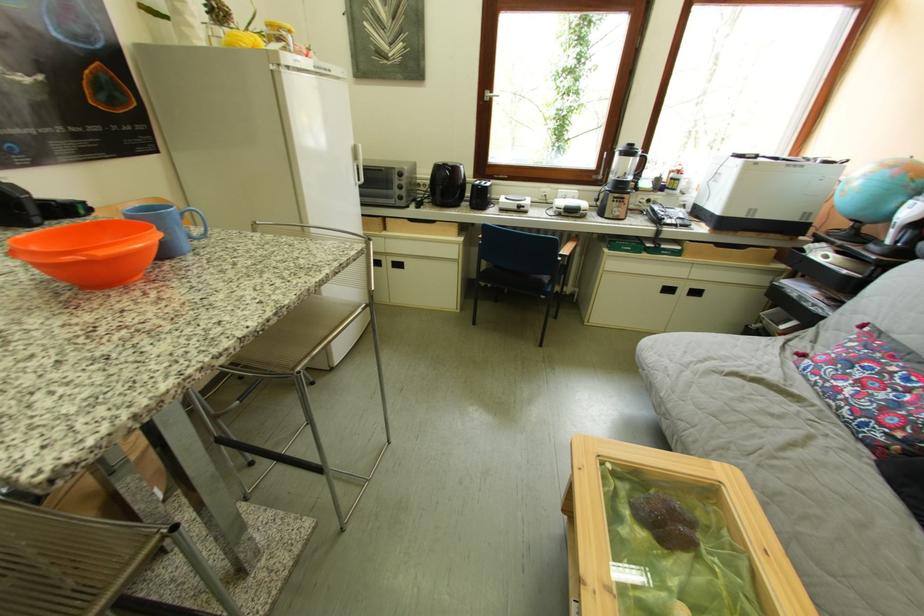
Find the location of a particular element. refrigerator handle is located at coordinates (358, 169).